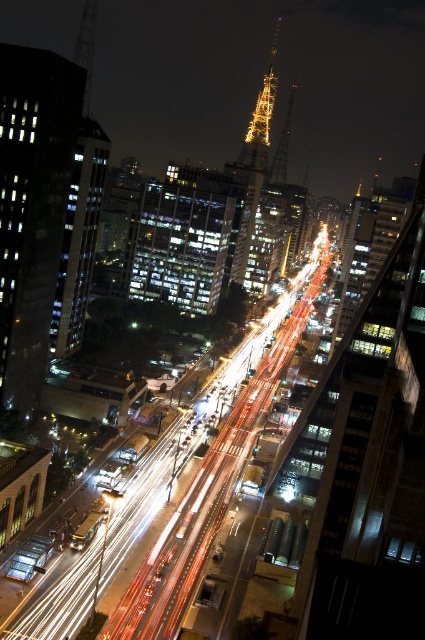
Does point (232, 216) come closer to viewer compared to point (257, 118)?

That is True.

Where is `glassy reflective building at center`? The height and width of the screenshot is (640, 425). glassy reflective building at center is located at coordinates (184, 237).